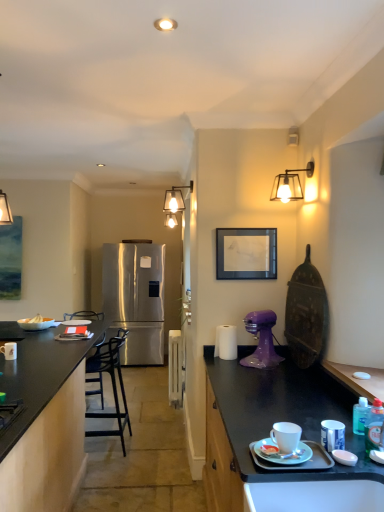
Question: Visually, is white matte bowl at left positioned to the left or to the right of metallic glass lampshade at upper right, which is the 1th lamp from front to back?

Choices:
 (A) left
 (B) right

Answer: (A)

Question: From a real-world perspective, is white matte bowl at left physically located above or below metallic glass lampshade at upper right, which is the 1th lamp from front to back?

Choices:
 (A) below
 (B) above

Answer: (A)

Question: Considering the real-world distances, which object is farthest from the purple plastic mixer at center-right?

Choices:
 (A) wooden pizza peel at right
 (B) white matte bowl at left
 (C) stainless steel refrigerator at center
 (D) white glossy book at center, positioned as the 1th tableware in left-to-right order
 (E) metallic glass lampshade at upper right, which is the second lamp in back-to-front order

Answer: (C)

Question: Which of these objects is positioned farthest from the white matte plate at right, which is counted as the first tableware, starting from the right?

Choices:
 (A) white glossy mug at lower right, the first coffee cup in the front-to-back sequence
 (B) matte glass lamp at center, which is counted as the first lamp, starting from the back
 (C) purple plastic mixer at center-right
 (D) porcelain saucer at lower right
 (E) black matte picture frame at center

Answer: (B)